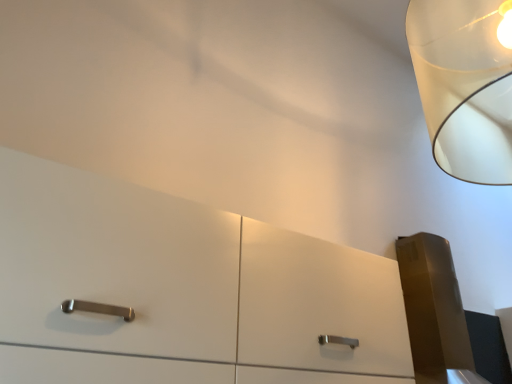
Question: From the image's perspective, relative to transparent plastic lampshade at upper right, is white glossy dresser at center above or below?

Choices:
 (A) below
 (B) above

Answer: (A)

Question: In terms of size, does white glossy dresser at center appear bigger or smaller than transparent plastic lampshade at upper right?

Choices:
 (A) small
 (B) big

Answer: (B)

Question: Is point (269, 269) closer or farther from the camera than point (446, 112)?

Choices:
 (A) farther
 (B) closer

Answer: (B)

Question: Is transparent plastic lampshade at upper right inside the boundaries of white glossy dresser at center, or outside?

Choices:
 (A) inside
 (B) outside

Answer: (B)

Question: From a real-world perspective, relative to white glossy dresser at center, is transparent plastic lampshade at upper right vertically above or below?

Choices:
 (A) below
 (B) above

Answer: (B)

Question: Considering the positions of transparent plastic lampshade at upper right and white glossy dresser at center in the image, is transparent plastic lampshade at upper right bigger or smaller than white glossy dresser at center?

Choices:
 (A) big
 (B) small

Answer: (B)

Question: In the image, is transparent plastic lampshade at upper right positioned in front of or behind white glossy dresser at center?

Choices:
 (A) behind
 (B) front

Answer: (A)